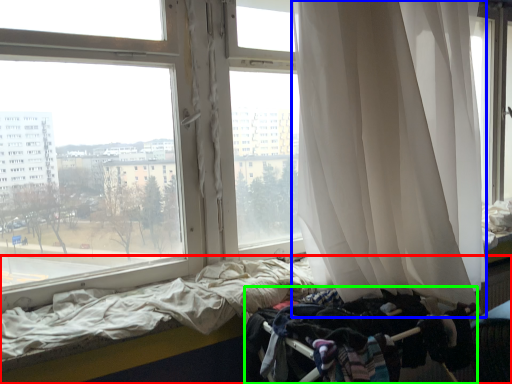
Question: Which object is the farthest from bed (highlighted by a red box)? Choose among these: curtain (highlighted by a blue box) or baby carriage (highlighted by a green box).

Choices:
 (A) curtain
 (B) baby carriage

Answer: (A)